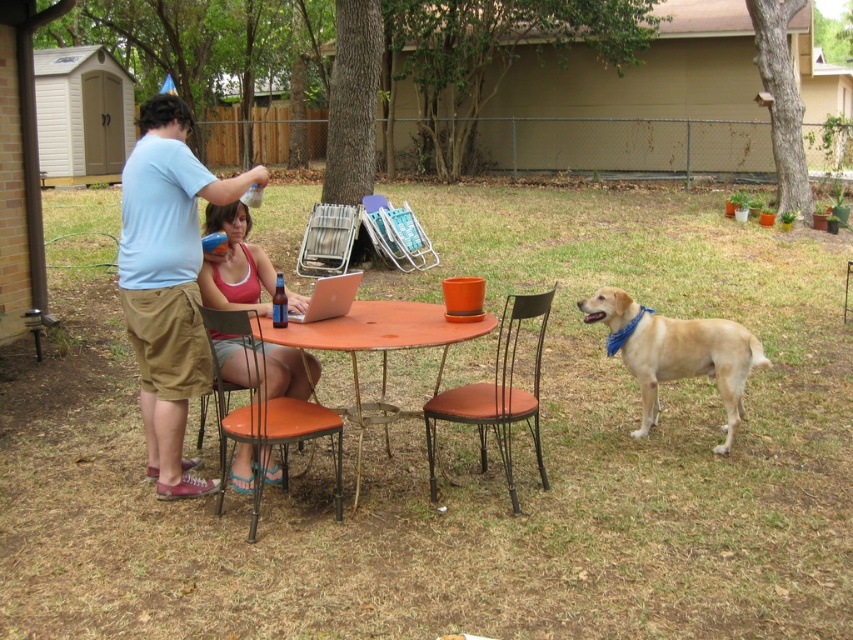
You are planning to set up a small garden between the metallic orange chair at center and the metallic silver folding chair at center. Based on their positions, which chair should you place the garden closer to in order to have it between them?

The metallic orange chair at center is located below the metallic silver folding chair at center, so to place the garden between them, it should be closer to the metallic orange chair at center since it is lower and the silver chair is above it.